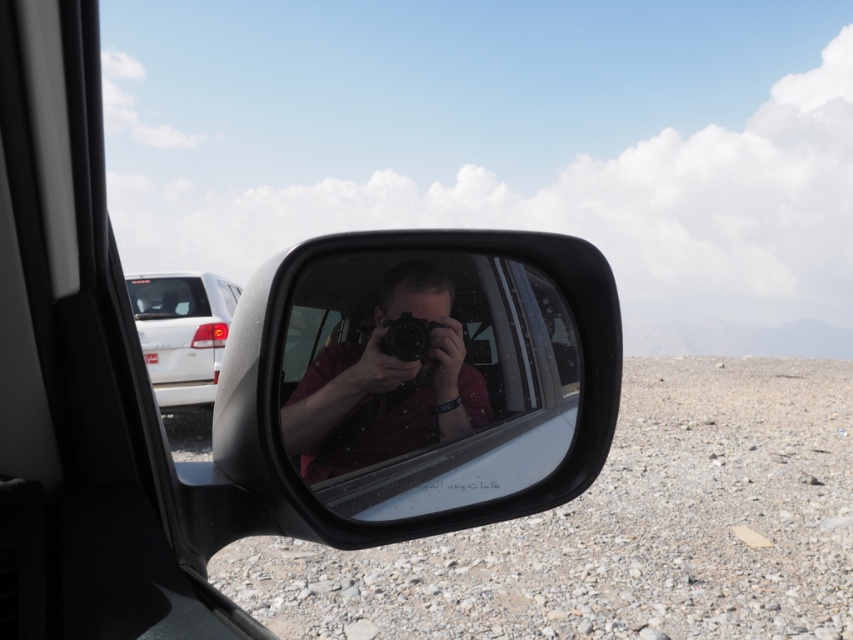
You are driving a car and want to check if the black plastic car mirror at center can fully display the white glossy sedan at upper left in its reflection. Based on their heights, can the mirror show the entire sedan?

The black plastic car mirror at center has a lesser height compared to white glossy sedan at upper left. Since the mirror is shorter, it might not fully capture the entire height of the sedan in its reflection.

You are a photographer trying to capture the reflection of the white glossy sedan at upper left and the clear glass car window at upper left in the side mirror. Based on their sizes in the reflection, which one will appear larger?

The white glossy sedan at upper left is bigger than the clear glass car window at upper left, so in the reflection, the white glossy sedan at upper left will appear larger.